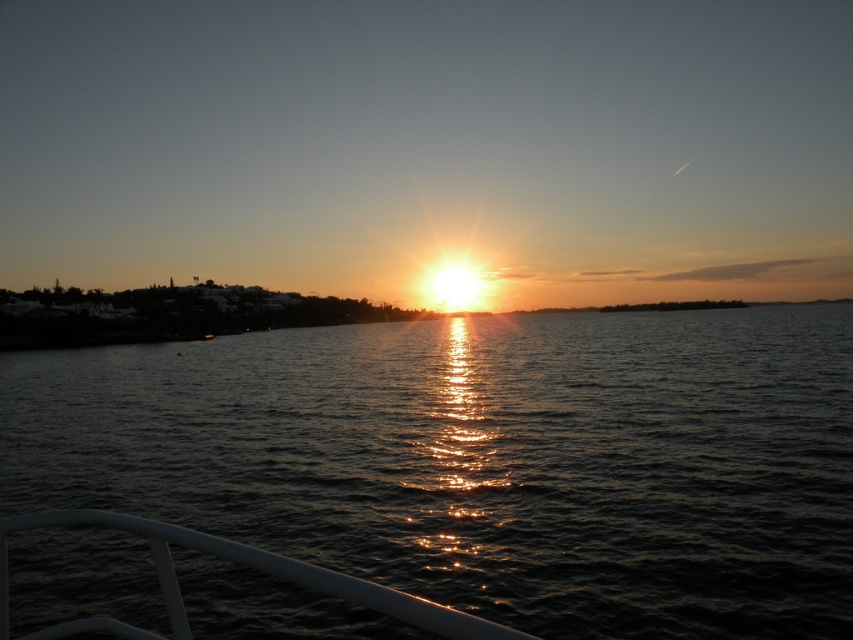
In the scene shown: Between glistening water at center and white glossy rail at lower center, which one appears on the left side from the viewer's perspective?

From the viewer's perspective, white glossy rail at lower center appears more on the left side.

Is glistening water at center closer to the viewer compared to white glossy rail at lower center?

That is False.

Where is `glistening water at center`? The height and width of the screenshot is (640, 853). glistening water at center is located at coordinates (485, 460).